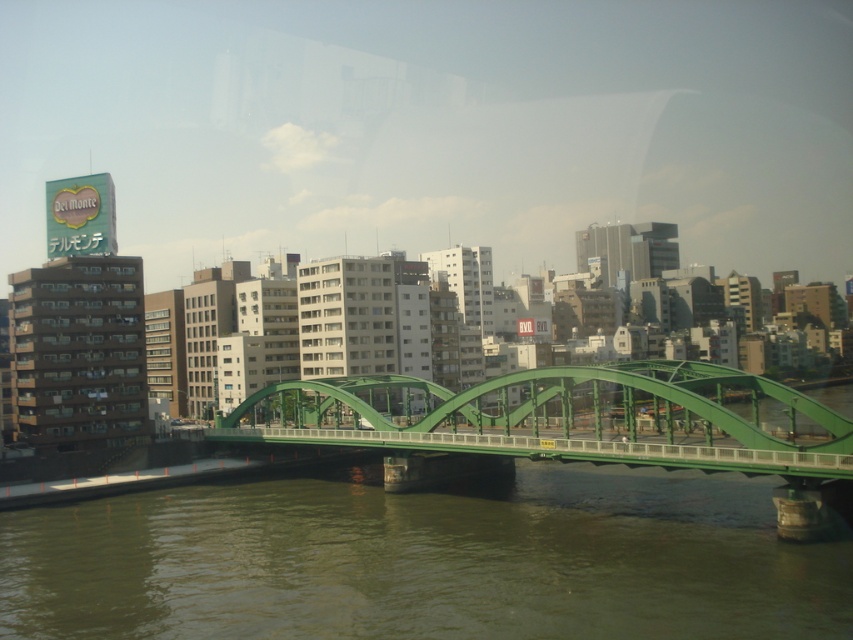
Does green concrete river at center have a greater width compared to green metallic bridge at center?

Yes, green concrete river at center is wider than green metallic bridge at center.

Is point (660, 554) farther from camera compared to point (531, 422)?

No, it is not.

At what (x,y) coordinates should I click in order to perform the action: click on green concrete river at center. Please return your answer as a coordinate pair (x, y). Looking at the image, I should click on (424, 561).

Find the location of a particular element. This screenshot has height=640, width=853. green concrete river at center is located at coordinates (424, 561).